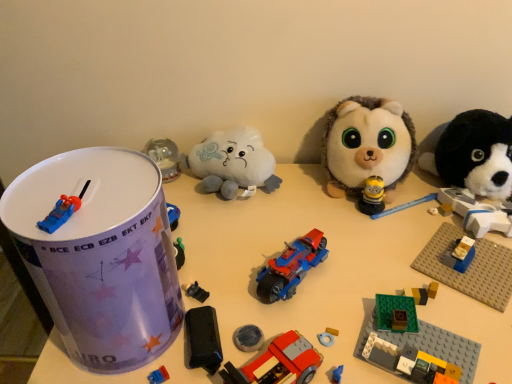
This screenshot has height=384, width=512. Find the location of `vacant area on the back side of shiny plastic motorcycle at center, which is the sixth toy in left-to-right order`. vacant area on the back side of shiny plastic motorcycle at center, which is the sixth toy in left-to-right order is located at coordinates (282, 209).